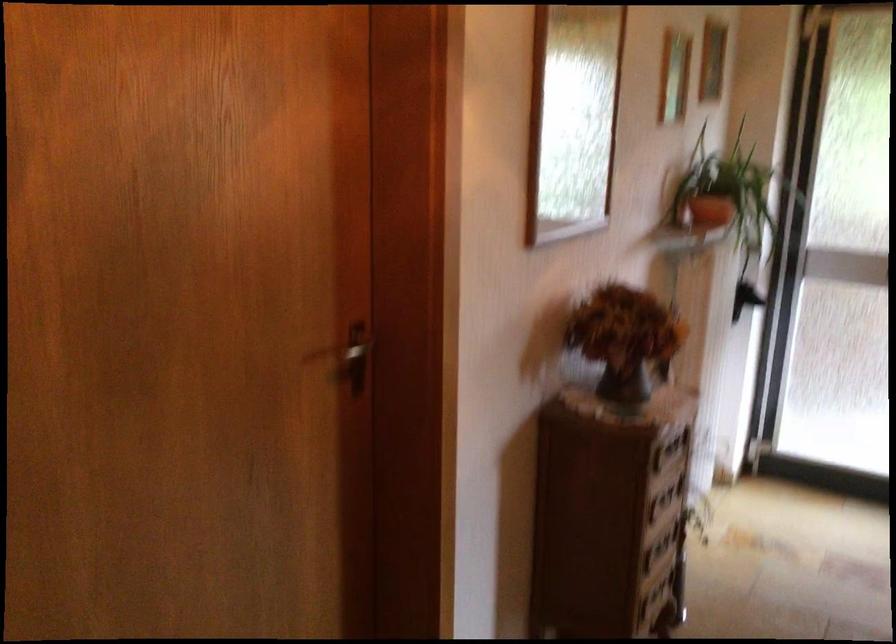
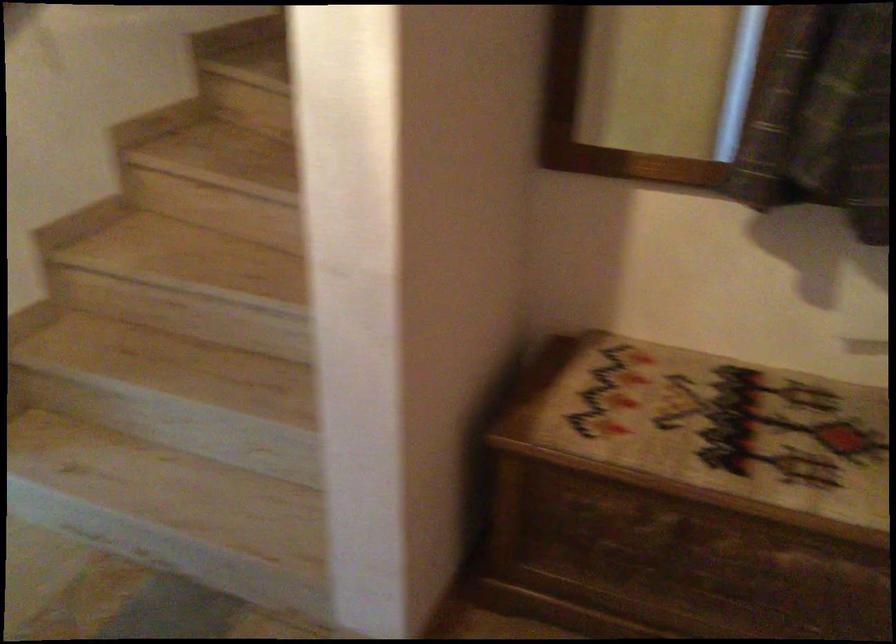
How did the camera likely rotate?

The rotation direction of the camera is right-down.